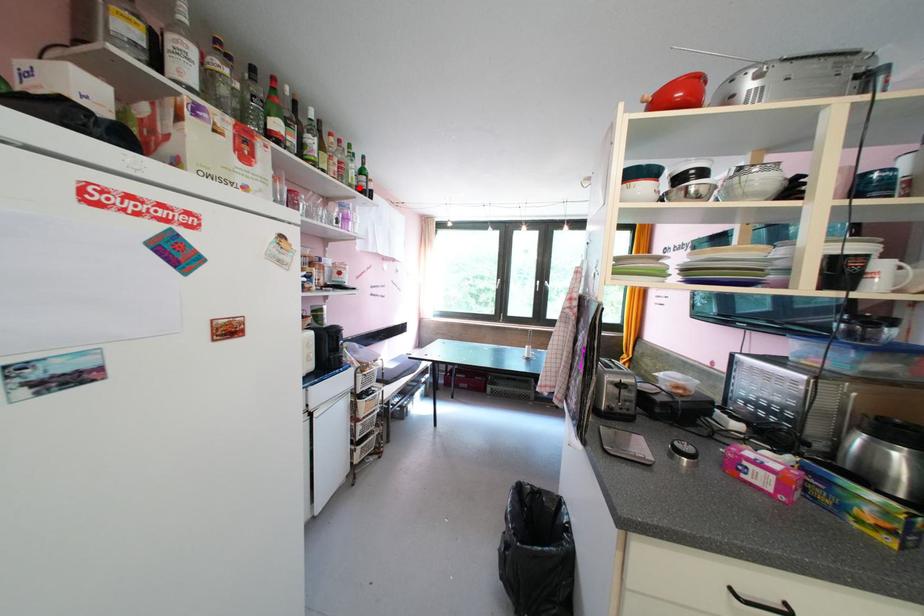
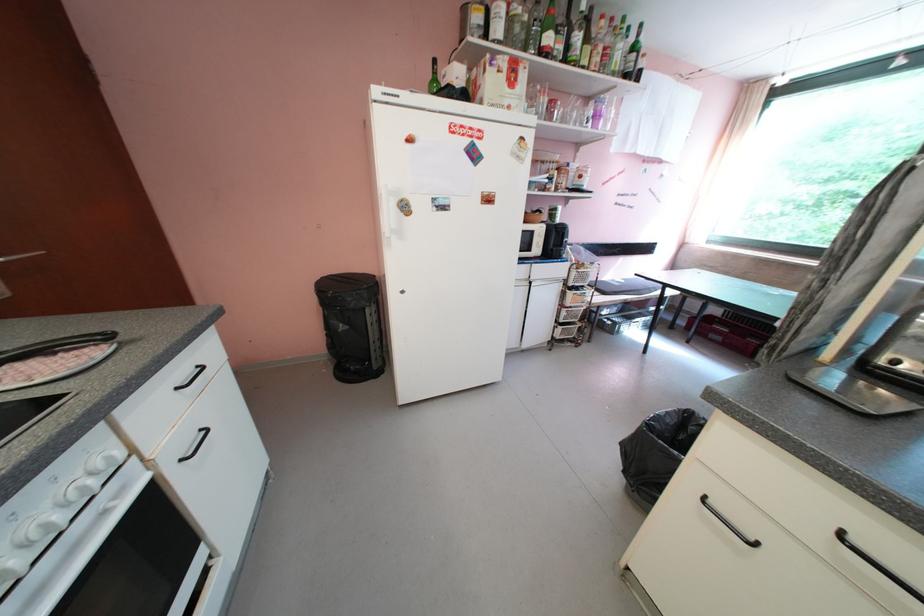
Locate, in the second image, the point that corresponds to the highlighted location in the first image.

(622, 75)